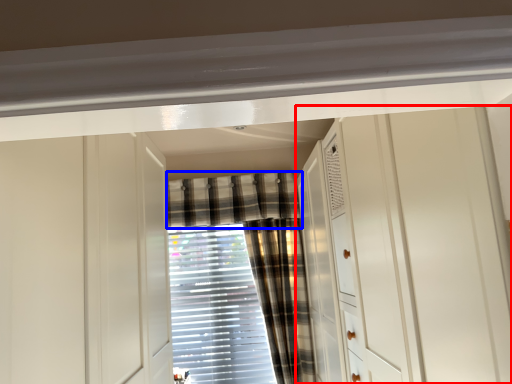
Question: Among these objects, which one is nearest to the camera, dresser (highlighted by a red box) or curtain (highlighted by a blue box)?

Choices:
 (A) dresser
 (B) curtain

Answer: (A)